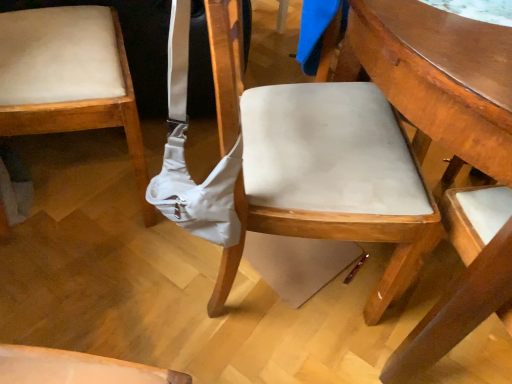
Question: Does point (210, 13) appear closer or farther from the camera than point (217, 168)?

Choices:
 (A) closer
 (B) farther

Answer: (A)

Question: From the image's perspective, relative to white fabric shoulder bag at center, is matte white chair at center, which is the first chair from right to left, above or below?

Choices:
 (A) below
 (B) above

Answer: (A)

Question: Based on their relative distances, which object is farther from the matte beige cushion at left, the 2th chair when ordered from right to left?

Choices:
 (A) wooden table at center
 (B) white fabric shoulder bag at center
 (C) matte white chair at center, which is the first chair from right to left

Answer: (A)

Question: Which object is positioned farthest from the white fabric shoulder bag at center?

Choices:
 (A) matte white chair at center, which is the first chair from right to left
 (B) wooden table at center
 (C) matte beige cushion at left, the 2th chair when ordered from right to left

Answer: (B)